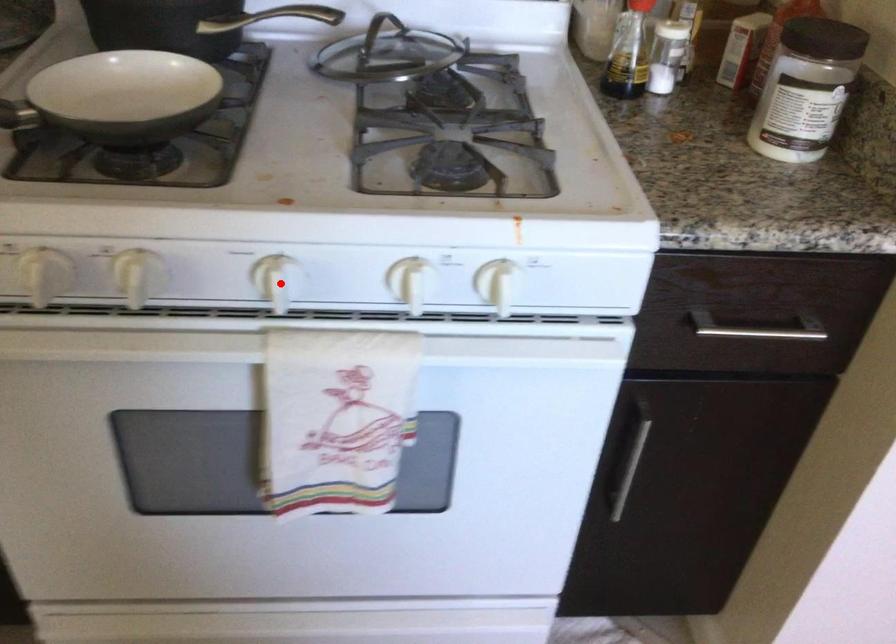
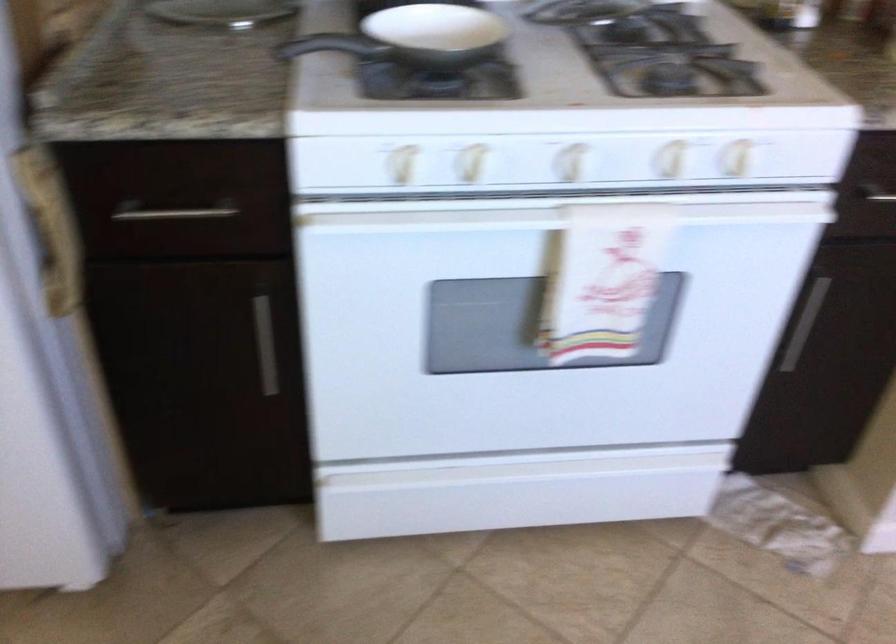
Where in the second image is the point corresponding to the highlighted location from the first image?

(573, 162)